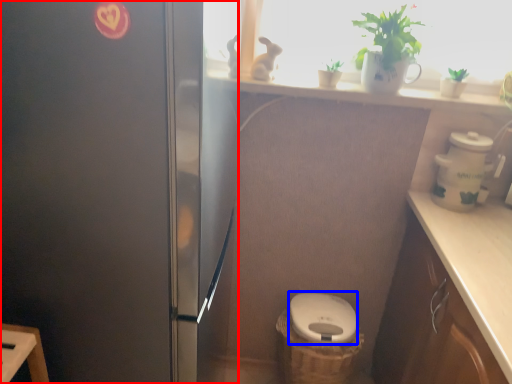
Question: Which object is further to the camera taking this photo, fridge (highlighted by a red box) or toilet bowl (highlighted by a blue box)?

Choices:
 (A) fridge
 (B) toilet bowl

Answer: (B)